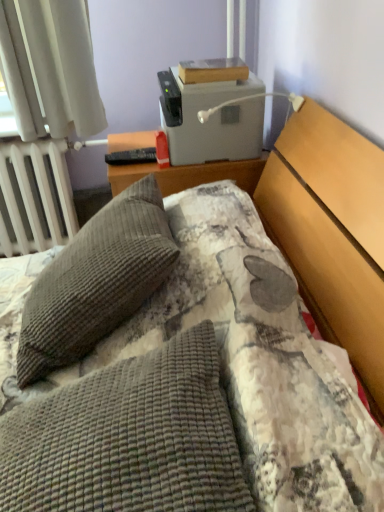
The width and height of the screenshot is (384, 512). What do you see at coordinates (129, 439) in the screenshot?
I see `brown corduroy pillow at center, the 2th pillow viewed from the back` at bounding box center [129, 439].

Measure the distance between gray plastic printer at upper center and camera.

gray plastic printer at upper center is 1.29 meters away from camera.

Describe the element at coordinates (211, 111) in the screenshot. I see `gray plastic printer at upper center` at that location.

Where is `brown corduroy pillow at center, the 2th pillow viewed from the back`? This screenshot has width=384, height=512. brown corduroy pillow at center, the 2th pillow viewed from the back is located at coordinates (129, 439).

Can we say gray plastic printer at upper center lies outside gray corduroy pillow at left, acting as the second pillow starting from the front?

Yes, gray plastic printer at upper center is located beyond the bounds of gray corduroy pillow at left, acting as the second pillow starting from the front.

Does gray plastic printer at upper center appear on the right side of gray corduroy pillow at left, which appears as the first pillow when viewed from the back?

Correct, you'll find gray plastic printer at upper center to the right of gray corduroy pillow at left, which appears as the first pillow when viewed from the back.

Considering the points (184, 83) and (128, 199), which point is in front, point (184, 83) or point (128, 199)?

Point (128, 199)

Is gray plastic printer at upper center further to the viewer compared to gray corduroy pillow at left, acting as the second pillow starting from the front?

Yes, it is.

How different are the orientations of brown corduroy pillow at center, which is the first pillow in front-to-back order, and wooden book at upper center in degrees?

0.255 degrees.

Is brown corduroy pillow at center, the 2th pillow viewed from the back, wider or thinner than wooden book at upper center?

Considering their sizes, brown corduroy pillow at center, the 2th pillow viewed from the back, looks broader than wooden book at upper center.

Between brown corduroy pillow at center, which is the first pillow in front-to-back order, and wooden book at upper center, which one has larger size?

brown corduroy pillow at center, which is the first pillow in front-to-back order.

In the image, is brown corduroy pillow at center, which is the first pillow in front-to-back order, on the left side or the right side of wooden book at upper center?

In the image, brown corduroy pillow at center, which is the first pillow in front-to-back order, appears on the left side of wooden book at upper center.

Does brown corduroy pillow at center, the 2th pillow viewed from the back, have a lesser height compared to gray corduroy pillow at left, which appears as the first pillow when viewed from the back?

Yes.

Which is further, (x=62, y=500) or (x=82, y=242)?

The point (x=82, y=242) is farther.

Is brown corduroy pillow at center, the 2th pillow viewed from the back, not inside gray corduroy pillow at left, acting as the second pillow starting from the front?

brown corduroy pillow at center, the 2th pillow viewed from the back, is positioned outside gray corduroy pillow at left, acting as the second pillow starting from the front.

Where is `pillow below the gray corduroy pillow at left, which appears as the first pillow when viewed from the back (from a real-world perspective)`? pillow below the gray corduroy pillow at left, which appears as the first pillow when viewed from the back (from a real-world perspective) is located at coordinates (129, 439).

How different are the orientations of white plastic lamp at upper right and brown corduroy pillow at center, the 2th pillow viewed from the back, in degrees?

The angular difference between white plastic lamp at upper right and brown corduroy pillow at center, the 2th pillow viewed from the back, is 0.000523 degrees.

Considering their positions, is white plastic lamp at upper right located in front of or behind brown corduroy pillow at center, the 2th pillow viewed from the back?

In the image, white plastic lamp at upper right appears behind brown corduroy pillow at center, the 2th pillow viewed from the back.

Can you confirm if white plastic lamp at upper right is taller than brown corduroy pillow at center, which is the first pillow in front-to-back order?

Incorrect, the height of white plastic lamp at upper right is not larger of that of brown corduroy pillow at center, which is the first pillow in front-to-back order.

Between white plastic lamp at upper right and brown corduroy pillow at center, which is the first pillow in front-to-back order, which one has larger size?

brown corduroy pillow at center, which is the first pillow in front-to-back order, is bigger.

Which object is thinner, gray plastic printer at upper center or white metallic radiator at left?

With smaller width is white metallic radiator at left.

You are a GUI agent. You are given a task and a screenshot of the screen. Output one action in this format:
    pyautogui.click(x=<x>, y=<y>)
    Task: Click on the printer in front of the white metallic radiator at left
    The width and height of the screenshot is (384, 512).
    Given the screenshot: What is the action you would take?
    pyautogui.click(x=211, y=111)

Is gray plastic printer at upper center not near white metallic radiator at left?

That's not correct — gray plastic printer at upper center is a little close to white metallic radiator at left.

Would you consider gray corduroy pillow at left, acting as the second pillow starting from the front, to be distant from white metallic radiator at left?

No.

Considering the positions of objects gray corduroy pillow at left, which appears as the first pillow when viewed from the back, and white metallic radiator at left in the image provided, who is more to the right, gray corduroy pillow at left, which appears as the first pillow when viewed from the back, or white metallic radiator at left?

Positioned to the right is gray corduroy pillow at left, which appears as the first pillow when viewed from the back.

Identify the location of the 1st pillow in front of the white metallic radiator at left. This screenshot has height=512, width=384. (96, 281).

Is gray corduroy pillow at left, acting as the second pillow starting from the front, further to the viewer compared to white metallic radiator at left?

No.

Considering the positions of objects white plastic lamp at upper right and wooden book at upper center in the image provided, who is more to the left, white plastic lamp at upper right or wooden book at upper center?

From the viewer's perspective, wooden book at upper center appears more on the left side.

Is white plastic lamp at upper right next to wooden book at upper center and touching it?

No, white plastic lamp at upper right is not touching wooden book at upper center.

How different are the orientations of white plastic lamp at upper right and wooden book at upper center in degrees?

There is a 0.255-degree angle between the facing directions of white plastic lamp at upper right and wooden book at upper center.

Does white plastic lamp at upper right have a lesser height compared to wooden book at upper center?

No.

Find the location of a particular element. The image size is (384, 512). the 1st pillow located beneath the gray plastic printer at upper center (from a real-world perspective) is located at coordinates (96, 281).

From the wooden book at upper center, count the 1st pillow to the left and point to it. Please provide its 2D coordinates.

[(129, 439)]

When comparing their distances from white plastic lamp at upper right, does brown corduroy pillow at center, which is the first pillow in front-to-back order, or gray plastic printer at upper center seem closer?

gray plastic printer at upper center lies closer to white plastic lamp at upper right than the other object.

Based on their spatial positions, is gray plastic printer at upper center or wooden book at upper center closer to gray corduroy pillow at left, which appears as the first pillow when viewed from the back?

gray plastic printer at upper center.

Estimate the real-world distances between objects in this image. Which object is closer to brown corduroy pillow at center, which is the first pillow in front-to-back order, white metallic radiator at left or gray corduroy pillow at left, acting as the second pillow starting from the front?

gray corduroy pillow at left, acting as the second pillow starting from the front, is closer to brown corduroy pillow at center, which is the first pillow in front-to-back order.

Estimate the real-world distances between objects in this image. Which object is closer to white plastic lamp at upper right, wooden book at upper center or white metallic radiator at left?

Among the two, wooden book at upper center is located nearer to white plastic lamp at upper right.

Estimate the real-world distances between objects in this image. Which object is further from gray plastic printer at upper center, brown corduroy pillow at center, the 2th pillow viewed from the back, or wooden book at upper center?

brown corduroy pillow at center, the 2th pillow viewed from the back, is positioned further to the anchor gray plastic printer at upper center.

Estimate the real-world distances between objects in this image. Which object is closer to gray plastic printer at upper center, gray corduroy pillow at left, which appears as the first pillow when viewed from the back, or white metallic radiator at left?

The object closer to gray plastic printer at upper center is gray corduroy pillow at left, which appears as the first pillow when viewed from the back.

Estimate the real-world distances between objects in this image. Which object is closer to brown corduroy pillow at center, the 2th pillow viewed from the back, gray plastic printer at upper center or white plastic lamp at upper right?

gray plastic printer at upper center lies closer to brown corduroy pillow at center, the 2th pillow viewed from the back, than the other object.

Estimate the real-world distances between objects in this image. Which object is closer to gray corduroy pillow at left, acting as the second pillow starting from the front, gray plastic printer at upper center or white metallic radiator at left?

gray plastic printer at upper center lies closer to gray corduroy pillow at left, acting as the second pillow starting from the front, than the other object.

The width and height of the screenshot is (384, 512). In order to click on pillow between brown corduroy pillow at center, which is the first pillow in front-to-back order, and wooden book at upper center in the front-back direction in this screenshot , I will do `click(96, 281)`.

The width and height of the screenshot is (384, 512). In order to click on pillow between brown corduroy pillow at center, which is the first pillow in front-to-back order, and gray plastic printer at upper center in the front-back direction in this screenshot , I will do `click(96, 281)`.

The width and height of the screenshot is (384, 512). What are the coordinates of `pillow between brown corduroy pillow at center, the 2th pillow viewed from the back, and white plastic lamp at upper right in the front-back direction` in the screenshot? It's located at (96, 281).

Locate an element on the screen. This screenshot has width=384, height=512. lamp positioned between gray corduroy pillow at left, acting as the second pillow starting from the front, and wooden book at upper center from near to far is located at coordinates (248, 100).